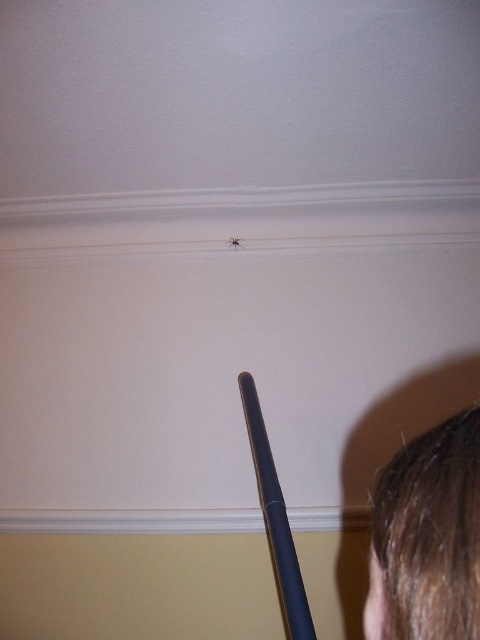
Who is shorter, dark brown hair at lower right or translucent plastic spider at upper center?

With less height is translucent plastic spider at upper center.

Locate an element on the screen. The width and height of the screenshot is (480, 640). dark brown hair at lower right is located at coordinates (428, 538).

Is point (393, 477) farther from camera compared to point (228, 241)?

No, it is not.

Image resolution: width=480 pixels, height=640 pixels. In order to click on dark brown hair at lower right in this screenshot , I will do `click(428, 538)`.